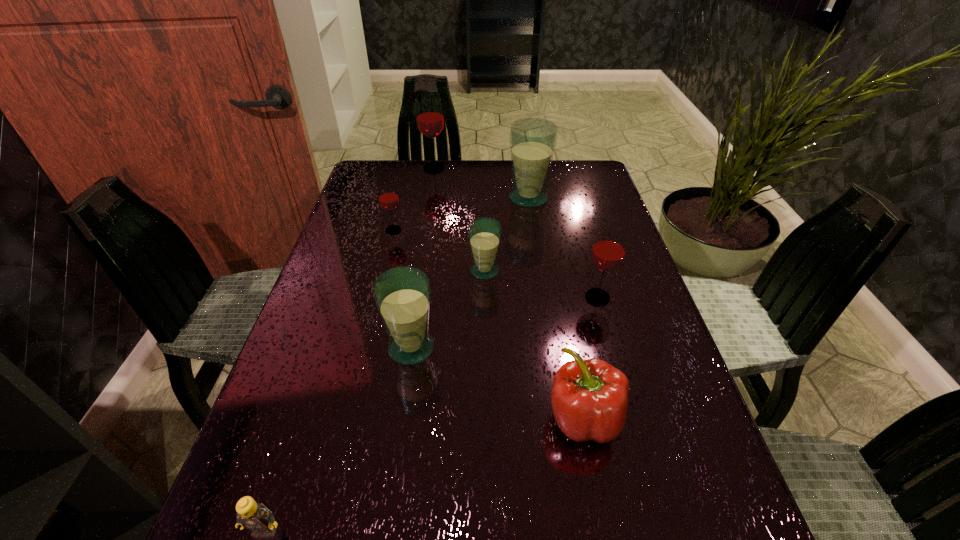
Where is `the second red glass from right to left`? The image size is (960, 540). the second red glass from right to left is located at coordinates (430, 121).

The image size is (960, 540). I want to click on the farthest object, so click(430, 121).

Locate an element on the screen. The image size is (960, 540). the seventh nearest object is located at coordinates (532, 140).

Identify the location of the biggest blue glass. (532, 140).

This screenshot has height=540, width=960. I want to click on the rightmost glass, so click(608, 251).

Find the location of a particular element. The height and width of the screenshot is (540, 960). the rightmost red glass is located at coordinates (608, 251).

Find the location of a particular element. the leftmost blue glass is located at coordinates click(x=402, y=295).

You are a GUI agent. You are given a task and a screenshot of the screen. Output one action in this format:
    pyautogui.click(x=<x>, y=<y>)
    Task: Click on the third nearest object
    
    Given the screenshot: What is the action you would take?
    pyautogui.click(x=402, y=295)

Locate an element on the screen. the fifth object from left to right is located at coordinates (484, 234).

What are the coordinates of `the smallest blue glass` in the screenshot? It's located at (484, 234).